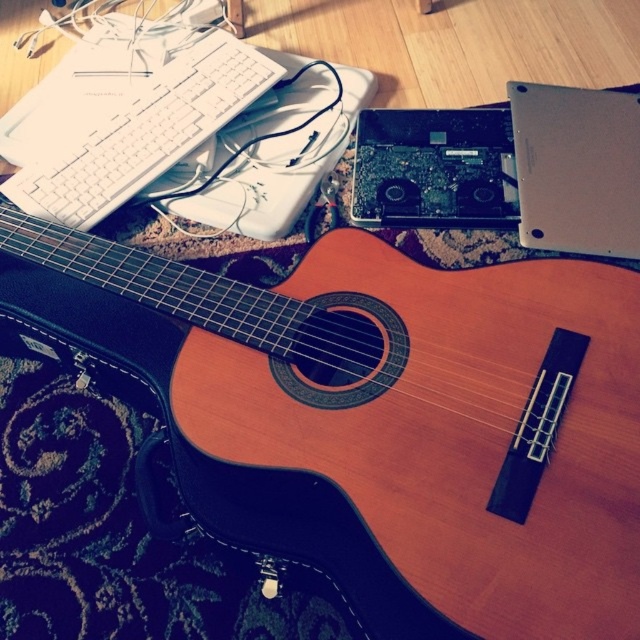
You are standing in the room and want to pick up an object that is exactly at point (509, 93). Can you reach it without moving your feet? Your arm can extend 1.2 meters from your body.

The point (509, 93) is 1.19 meters away from the viewer. Since your arm can extend 1.2 meters, you can reach it without moving your feet.

You are an interior designer planning to place a new sofa in the room. The sofa must be positioned so that it faces the wooden acoustic guitar resting on its case. However, there is a silver metallic laptop at upper right located at point (577, 168). Will the sofa block the view of the wooden acoustic guitar resting on its case if placed directly in front of the laptop?

The silver metallic laptop at upper right is located at point (577, 168), so placing the sofa directly in front of it might block the view of the wooden acoustic guitar resting on its case depending on the sofa size and placement.

You are organizing a desk and need to place both the silver metallic laptop at upper right and the black plastic laptop at upper center. According to the image, which one should you place on the left side of the desk?

The black plastic laptop at upper center should be placed on the left side of the desk because the silver metallic laptop at upper right is to the right of it in the image.